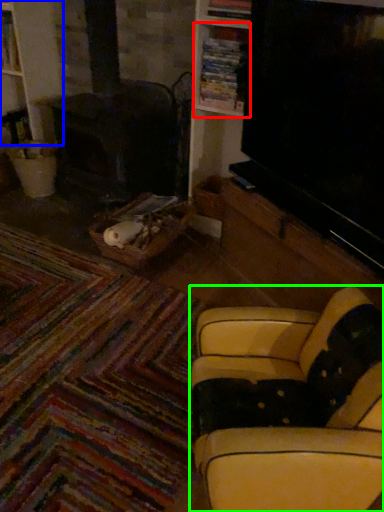
Question: Estimate the real-world distances between objects in this image. Which object is farther from shelf (highlighted by a red box), bookshelf (highlighted by a blue box) or studio couch (highlighted by a green box)?

Choices:
 (A) bookshelf
 (B) studio couch

Answer: (B)